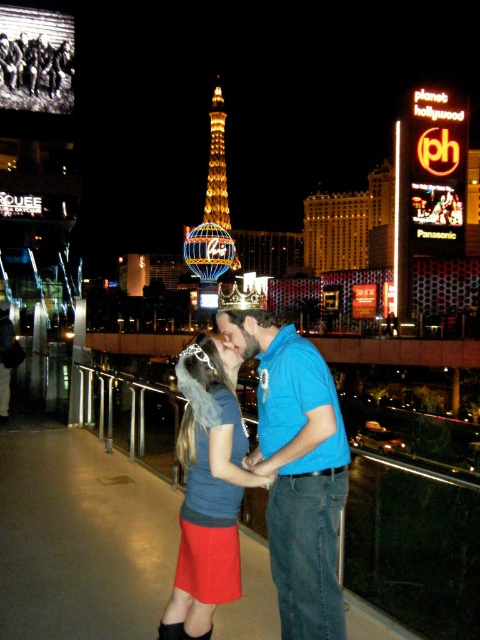
You are a photographer trying to capture the couple kissing on the pedestrian bridge in Las Vegas. The denim skirt at center is located at point (207, 490). Where should you position your camera to ensure the denim skirt at center is in the frame?

The denim skirt at center is located at point (207, 490), so you should position your camera to focus on that coordinate to include it in the frame.

You are a photographer taking a photo of the blue cotton shirt at center and the matte red skirt at center. Which clothing item will appear larger in the photo?

The blue cotton shirt at center will appear larger in the photo because it is bigger than the matte red skirt at center.